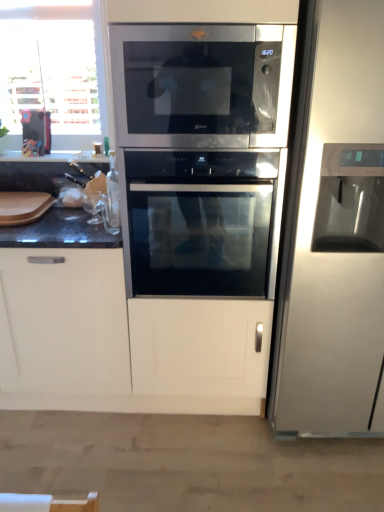
Question: Considering the positions of satin silver refrigerator at right and stainless steel microwave at center in the image, is satin silver refrigerator at right wider or thinner than stainless steel microwave at center?

Choices:
 (A) wide
 (B) thin

Answer: (A)

Question: From the image's perspective, relative to stainless steel microwave at center, is satin silver refrigerator at right above or below?

Choices:
 (A) above
 (B) below

Answer: (B)

Question: Which of these objects is positioned farthest from the stainless steel microwave at center?

Choices:
 (A) satin silver refrigerator at right
 (B) satin black oven at center

Answer: (A)

Question: Which of these objects is positioned farthest from the satin black oven at center?

Choices:
 (A) stainless steel microwave at center
 (B) satin silver refrigerator at right

Answer: (B)